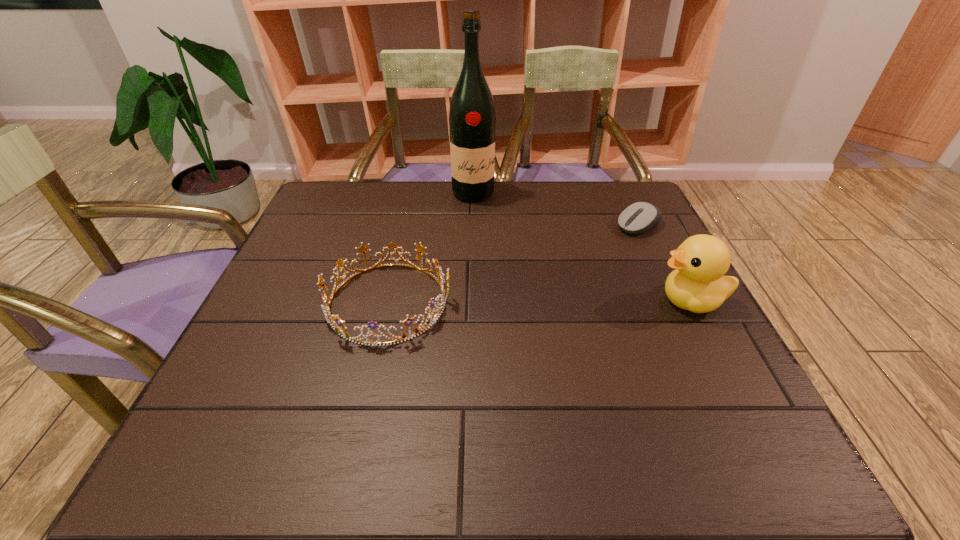
At what (x,y) coordinates should I click in order to perform the action: click on the second shortest object. Please return your answer as a coordinate pair (x, y). Looking at the image, I should click on (339, 328).

You are a GUI agent. You are given a task and a screenshot of the screen. Output one action in this format:
    pyautogui.click(x=<x>, y=<y>)
    Task: Click on the duck
    The image size is (960, 540).
    Given the screenshot: What is the action you would take?
    pyautogui.click(x=697, y=284)

The height and width of the screenshot is (540, 960). I want to click on the farthest object, so click(x=472, y=120).

I want to click on the tallest object, so click(x=472, y=120).

I want to click on the shortest object, so click(x=639, y=217).

Where is `the second farthest object`? The height and width of the screenshot is (540, 960). the second farthest object is located at coordinates (639, 217).

Where is `vacant space located 0.240m on the front-facing side of the third tallest object`? This screenshot has width=960, height=540. vacant space located 0.240m on the front-facing side of the third tallest object is located at coordinates (561, 302).

Find the location of `vacant space located on the face of the duck`. vacant space located on the face of the duck is located at coordinates (513, 301).

You are a GUI agent. You are given a task and a screenshot of the screen. Output one action in this format:
    pyautogui.click(x=<x>, y=<y>)
    Task: Click on the free space located 0.360m on the face of the duck
    
    Given the screenshot: What is the action you would take?
    pyautogui.click(x=490, y=301)

Image resolution: width=960 pixels, height=540 pixels. I want to click on vacant region located 0.190m on the face of the duck, so click(x=567, y=301).